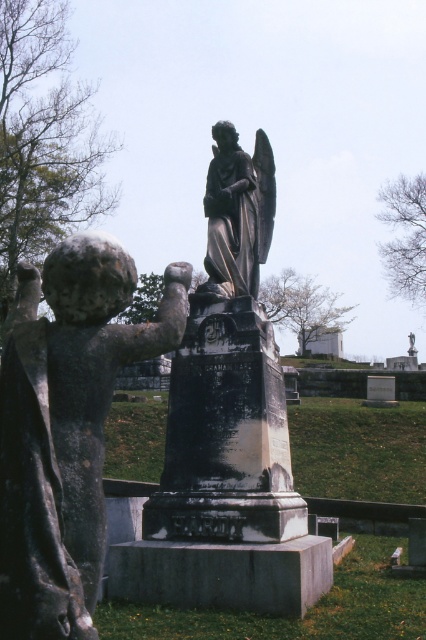
You are visiting a cemetery and see the matte stone cherub at left and the polished bronze angel at center. Which statue is positioned to the left of the other?

The matte stone cherub at left is positioned to the left of the polished bronze angel at center.

You are a visitor at the cemetery and want to take a photo of both the matte stone cherub at left and the polished bronze angel at center. Which statue should you focus on first to ensure both are in frame?

You should focus on the matte stone cherub at left first because it is closer to you than the polished bronze angel at center, ensuring both are in frame by adjusting the camera angle accordingly.

You are standing in the cemetery and want to take a photo of both the matte stone cherub at left and the black marble statue at center. Which statue should you position yourself to the right of to ensure both are in frame?

You should position yourself to the right of the matte stone cherub at left. Since the matte stone cherub at left is to the left of the black marble statue at center, standing to the right of the cherub will allow both statues to be captured in the frame.